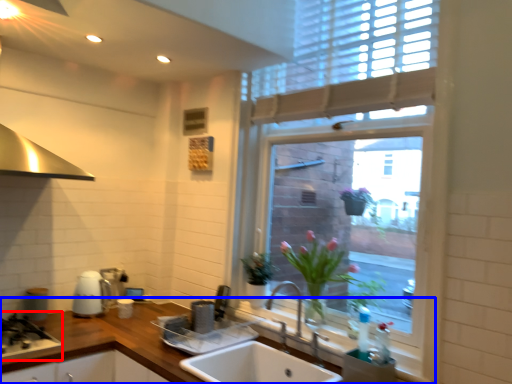
Question: Which of the following is the farthest to the observer, gas stove (highlighted by a red box) or countertop (highlighted by a blue box)?

Choices:
 (A) gas stove
 (B) countertop

Answer: (A)